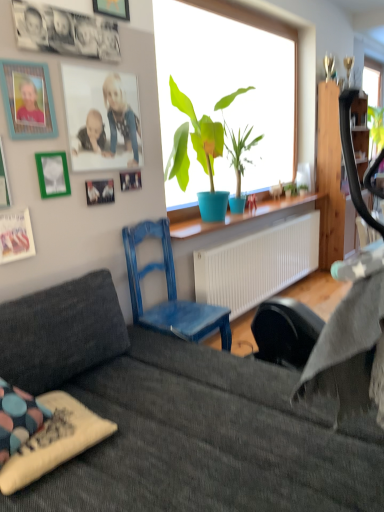
Question: Considering the positions of wooden picture frame at upper left, the 1th picture frame in the top-to-bottom sequence, and dark gray fabric couch at lower center in the image, is wooden picture frame at upper left, the 1th picture frame in the top-to-bottom sequence, taller or shorter than dark gray fabric couch at lower center?

Choices:
 (A) tall
 (B) short

Answer: (B)

Question: Relative to dark gray fabric couch at lower center, is wooden picture frame at upper left, the 8th picture frame in the bottom-to-top sequence, in front or behind?

Choices:
 (A) front
 (B) behind

Answer: (B)

Question: Which object is the farthest from the teal wooden picture frame at upper left, positioned as the 3th picture frame in top-to-bottom order?

Choices:
 (A) metallic silver picture frame at left, which ranks as the 8th picture frame in top-to-bottom order
 (B) green matte picture frame at upper left, the fifth picture frame positioned from the top
 (C) matte blue pot at window
 (D) polka dot fabric pillow at lower left
 (E) matte plastic picture frame at upper left, acting as the second picture frame starting from the top

Answer: (D)

Question: Based on their relative distances, which object is farther from the green matte picture frame at upper left, the 7th picture frame when ordered from top to bottom?

Choices:
 (A) dark gray fabric couch at lower center
 (B) green matte picture frame at upper left, the fifth picture frame positioned from the top
 (C) matte blue pot at window
 (D) wooden picture frame at upper left, which ranks as the fifth picture frame in bottom-to-top order
 (E) polka dot fabric pillow at lower left

Answer: (C)